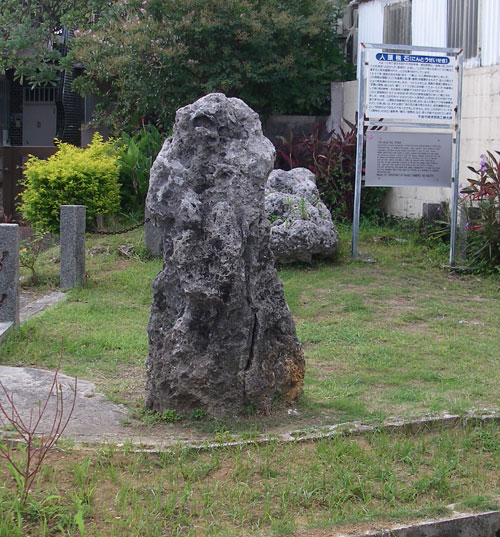
At what (x,y) coordinates should I click in order to perform the action: click on pillar. Please return your answer as a coordinate pair (x, y). The image size is (500, 537). Looking at the image, I should click on (71, 256).